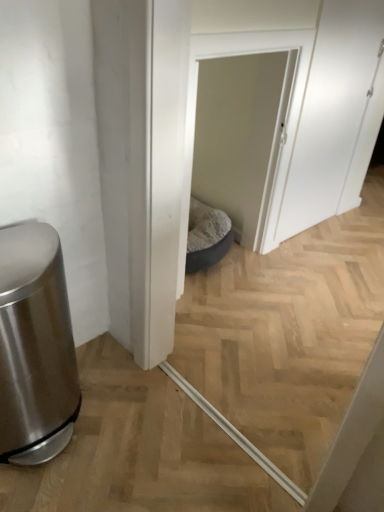
The width and height of the screenshot is (384, 512). What do you see at coordinates (336, 116) in the screenshot? I see `white matte screen door at upper right, which is the 1th screen door from right to left` at bounding box center [336, 116].

Locate an element on the screen. brushed metal trash can at left is located at coordinates (34, 345).

At what (x,y) coordinates should I click in order to perform the action: click on white matte screen door at upper right, which is the 1th screen door from right to left. Please return your answer as a coordinate pair (x, y). Looking at the image, I should click on (336, 116).

How different are the orientations of brushed metal trash can at left and white fabric pet bed at center, the second screen door when ordered from right to left, in degrees?

0.605 degrees separate the facing orientations of brushed metal trash can at left and white fabric pet bed at center, the second screen door when ordered from right to left.

Which of these two, brushed metal trash can at left or white fabric pet bed at center, arranged as the 1th screen door when viewed from the left, stands shorter?

With less height is brushed metal trash can at left.

Is brushed metal trash can at left bigger than white fabric pet bed at center, arranged as the 1th screen door when viewed from the left?

Yes, brushed metal trash can at left is bigger than white fabric pet bed at center, arranged as the 1th screen door when viewed from the left.

Considering the positions of points (242, 155) and (305, 128), is point (242, 155) farther from camera compared to point (305, 128)?

Yes, point (242, 155) is farther from viewer.

Is the position of white fabric pet bed at center, arranged as the 1th screen door when viewed from the left, more distant than that of white matte screen door at upper right, the second screen door when ordered from left to right?

No, white fabric pet bed at center, arranged as the 1th screen door when viewed from the left, is in front of white matte screen door at upper right, the second screen door when ordered from left to right.

From a real-world perspective, is white fabric pet bed at center, arranged as the 1th screen door when viewed from the left, positioned under white matte screen door at upper right, which is the 1th screen door from right to left, based on gravity?

Yes, from a real-world perspective, white fabric pet bed at center, arranged as the 1th screen door when viewed from the left, is below white matte screen door at upper right, which is the 1th screen door from right to left.

From the image's perspective, would you say brushed metal trash can at left is positioned over white matte screen door at upper right, which is the 1th screen door from right to left?

Actually, brushed metal trash can at left appears below white matte screen door at upper right, which is the 1th screen door from right to left, in the image.

Can you confirm if brushed metal trash can at left is shorter than white matte screen door at upper right, the second screen door when ordered from left to right?

Yes, brushed metal trash can at left is shorter than white matte screen door at upper right, the second screen door when ordered from left to right.

From a real-world perspective, is brushed metal trash can at left physically above white matte screen door at upper right, which is the 1th screen door from right to left?

No, from a real-world perspective, brushed metal trash can at left is not on top of white matte screen door at upper right, which is the 1th screen door from right to left.

Identify the location of waste container that is under the white fabric pet bed at center, the second screen door when ordered from right to left (from a real-world perspective). (34, 345).

Considering the positions of objects white fabric pet bed at center, arranged as the 1th screen door when viewed from the left, and brushed metal trash can at left in the image provided, who is more to the right, white fabric pet bed at center, arranged as the 1th screen door when viewed from the left, or brushed metal trash can at left?

white fabric pet bed at center, arranged as the 1th screen door when viewed from the left.

Is point (223, 187) closer to viewer compared to point (43, 388)?

No, (223, 187) is behind (43, 388).

From the image's perspective, between white fabric pet bed at center, arranged as the 1th screen door when viewed from the left, and brushed metal trash can at left, which one is located above?

white fabric pet bed at center, arranged as the 1th screen door when viewed from the left, is shown above in the image.

Can you tell me how much white matte screen door at upper right, which is the 1th screen door from right to left, and brushed metal trash can at left differ in facing direction?

The facing directions of white matte screen door at upper right, which is the 1th screen door from right to left, and brushed metal trash can at left are 0.605 degrees apart.

Does white matte screen door at upper right, which is the 1th screen door from right to left, touch brushed metal trash can at left?

They are not placed beside each other.

Does white matte screen door at upper right, the second screen door when ordered from left to right, have a larger size compared to brushed metal trash can at left?

Incorrect, white matte screen door at upper right, the second screen door when ordered from left to right, is not larger than brushed metal trash can at left.

Visually, is white matte screen door at upper right, which is the 1th screen door from right to left, positioned to the left or to the right of brushed metal trash can at left?

In the image, white matte screen door at upper right, which is the 1th screen door from right to left, appears on the right side of brushed metal trash can at left.

Considering the positions of objects white matte screen door at upper right, the second screen door when ordered from left to right, and white fabric pet bed at center, arranged as the 1th screen door when viewed from the left, in the image provided, who is more to the right, white matte screen door at upper right, the second screen door when ordered from left to right, or white fabric pet bed at center, arranged as the 1th screen door when viewed from the left,?

white matte screen door at upper right, the second screen door when ordered from left to right, is more to the right.

Is white matte screen door at upper right, which is the 1th screen door from right to left, smaller than white fabric pet bed at center, arranged as the 1th screen door when viewed from the left?

Actually, white matte screen door at upper right, which is the 1th screen door from right to left, might be larger than white fabric pet bed at center, arranged as the 1th screen door when viewed from the left.

Is point (370, 63) positioned after point (245, 138)?

Yes, point (370, 63) is behind point (245, 138).

Would you say white fabric pet bed at center, the second screen door when ordered from right to left, is part of white matte screen door at upper right, the second screen door when ordered from left to right,'s contents?

No, white matte screen door at upper right, the second screen door when ordered from left to right, does not contain white fabric pet bed at center, the second screen door when ordered from right to left.

Locate an element on the screen. The width and height of the screenshot is (384, 512). waste container below the white fabric pet bed at center, the second screen door when ordered from right to left (from a real-world perspective) is located at coordinates (34, 345).

Identify the location of screen door that is behind the white fabric pet bed at center, the second screen door when ordered from right to left. Image resolution: width=384 pixels, height=512 pixels. (336, 116).

Considering their positions, is white matte screen door at upper right, which is the 1th screen door from right to left, positioned closer to brushed metal trash can at left than white fabric pet bed at center, arranged as the 1th screen door when viewed from the left?

The object closer to brushed metal trash can at left is white fabric pet bed at center, arranged as the 1th screen door when viewed from the left.

Considering their positions, is white fabric pet bed at center, arranged as the 1th screen door when viewed from the left, positioned further to white matte screen door at upper right, the second screen door when ordered from left to right, than brushed metal trash can at left?

The object further to white matte screen door at upper right, the second screen door when ordered from left to right, is brushed metal trash can at left.

Looking at the image, which one is located further to white fabric pet bed at center, arranged as the 1th screen door when viewed from the left, white matte screen door at upper right, the second screen door when ordered from left to right, or brushed metal trash can at left?

The object further to white fabric pet bed at center, arranged as the 1th screen door when viewed from the left, is brushed metal trash can at left.

Based on their spatial positions, is white fabric pet bed at center, the second screen door when ordered from right to left, or white matte screen door at upper right, which is the 1th screen door from right to left, closer to brushed metal trash can at left?

Among the two, white fabric pet bed at center, the second screen door when ordered from right to left, is located nearer to brushed metal trash can at left.

Based on their spatial positions, is brushed metal trash can at left or white fabric pet bed at center, the second screen door when ordered from right to left, further from white matte screen door at upper right, which is the 1th screen door from right to left?

brushed metal trash can at left.

Looking at the image, which one is located closer to white fabric pet bed at center, the second screen door when ordered from right to left, brushed metal trash can at left or white matte screen door at upper right, which is the 1th screen door from right to left?

white matte screen door at upper right, which is the 1th screen door from right to left.

Find the location of a particular element. The width and height of the screenshot is (384, 512). screen door situated between brushed metal trash can at left and white matte screen door at upper right, the second screen door when ordered from left to right, from left to right is located at coordinates (240, 136).